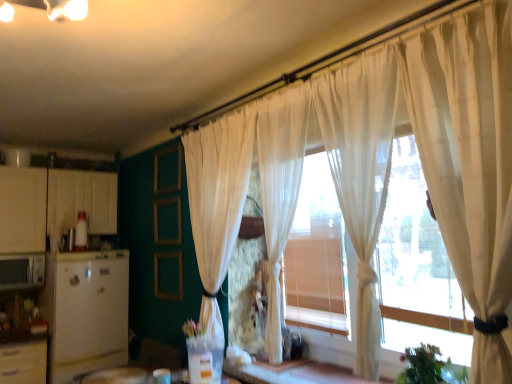
Question: Does sheer white curtain at center, which is the fourth curtain in right-to-left order, have a lesser height compared to white matte refrigerator at left, positioned as the second appliance in left-to-right order?

Choices:
 (A) no
 (B) yes

Answer: (A)

Question: Considering the relative sizes of sheer white curtain at center, which is the fourth curtain in right-to-left order, and white matte refrigerator at left, which appears as the first appliance when viewed from the right, in the image provided, is sheer white curtain at center, which is the fourth curtain in right-to-left order, bigger than white matte refrigerator at left, which appears as the first appliance when viewed from the right,?

Choices:
 (A) no
 (B) yes

Answer: (A)

Question: Is sheer white curtain at center, the first curtain in the left-to-right sequence, thinner than white matte refrigerator at left, which appears as the first appliance when viewed from the right?

Choices:
 (A) yes
 (B) no

Answer: (A)

Question: Does sheer white curtain at center, which is the fourth curtain in right-to-left order, appear on the left side of white matte refrigerator at left, positioned as the second appliance in left-to-right order?

Choices:
 (A) no
 (B) yes

Answer: (A)

Question: Is sheer white curtain at center, the first curtain in the left-to-right sequence, next to white matte refrigerator at left, positioned as the second appliance in left-to-right order, and touching it?

Choices:
 (A) no
 (B) yes

Answer: (A)

Question: Is point (408, 286) closer or farther from the camera than point (208, 173)?

Choices:
 (A) farther
 (B) closer

Answer: (B)

Question: From the image's perspective, relative to sheer white curtain at center, the first curtain in the left-to-right sequence, is translucent wood window frame at center above or below?

Choices:
 (A) above
 (B) below

Answer: (B)

Question: From a real-world perspective, is translucent wood window frame at center above or below sheer white curtain at center, the first curtain in the left-to-right sequence?

Choices:
 (A) below
 (B) above

Answer: (A)

Question: Considering the positions of translucent wood window frame at center and sheer white curtain at center, the first curtain in the left-to-right sequence, in the image, is translucent wood window frame at center taller or shorter than sheer white curtain at center, the first curtain in the left-to-right sequence,?

Choices:
 (A) tall
 (B) short

Answer: (B)

Question: From a real-world perspective, is sheer white curtain at right, placed as the 4th curtain when sorted from left to right, positioned above or below green leafy plant at lower right?

Choices:
 (A) above
 (B) below

Answer: (A)

Question: Is sheer white curtain at right, which ranks as the first curtain in right-to-left order, taller or shorter than green leafy plant at lower right?

Choices:
 (A) tall
 (B) short

Answer: (A)

Question: Based on their sizes in the image, would you say sheer white curtain at right, which ranks as the first curtain in right-to-left order, is bigger or smaller than green leafy plant at lower right?

Choices:
 (A) big
 (B) small

Answer: (A)

Question: Considering their positions, is sheer white curtain at right, placed as the 4th curtain when sorted from left to right, located in front of or behind green leafy plant at lower right?

Choices:
 (A) front
 (B) behind

Answer: (A)

Question: In terms of size, does translucent wood window frame at center appear bigger or smaller than sheer white curtain at right, which ranks as the first curtain in right-to-left order?

Choices:
 (A) big
 (B) small

Answer: (A)

Question: Considering the positions of translucent wood window frame at center and sheer white curtain at right, which ranks as the first curtain in right-to-left order, in the image, is translucent wood window frame at center taller or shorter than sheer white curtain at right, which ranks as the first curtain in right-to-left order,?

Choices:
 (A) short
 (B) tall

Answer: (A)